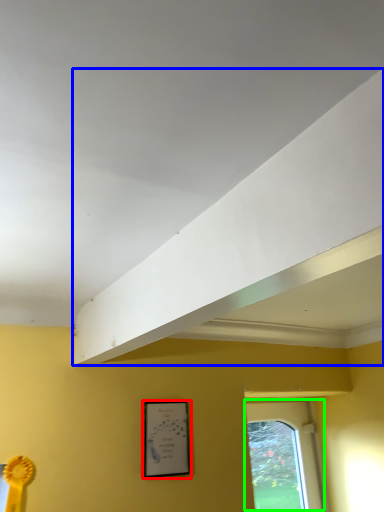
Question: Which object is the closest to the picture frame (highlighted by a red box)? Choose among these: exhaust hood (highlighted by a blue box) or window (highlighted by a green box).

Choices:
 (A) exhaust hood
 (B) window

Answer: (A)